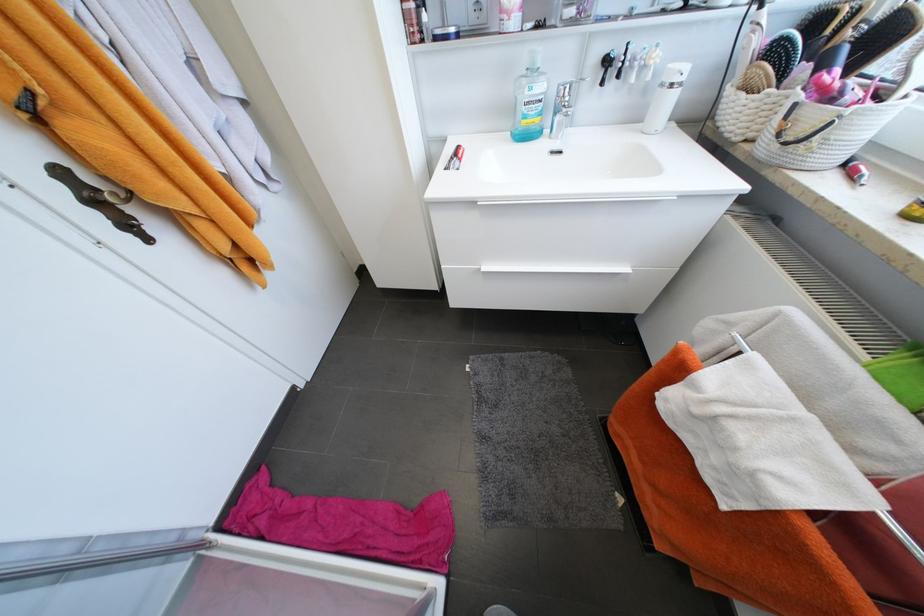
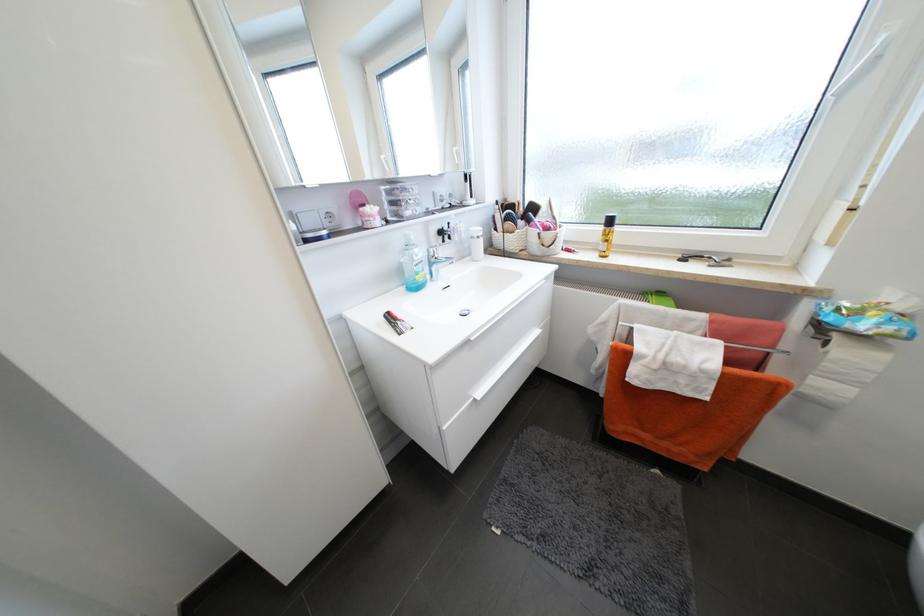
In the second image, find the point that corresponds to point 529,123 in the first image.

(423, 278)